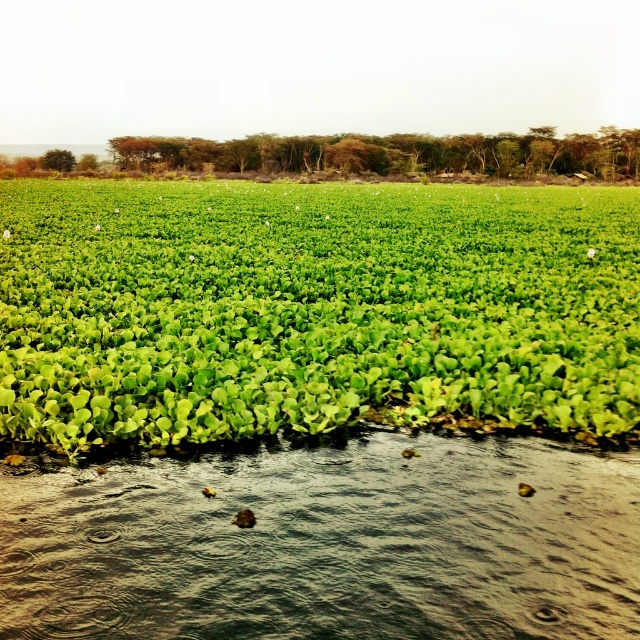
Question: Is green leafy plant at center bigger than green leafy water at lower center?

Choices:
 (A) no
 (B) yes

Answer: (B)

Question: Which point is farther to the camera?

Choices:
 (A) green leafy plant at center
 (B) green leafy water at lower center

Answer: (A)

Question: Is green leafy plant at center thinner than green leafy water at lower center?

Choices:
 (A) no
 (B) yes

Answer: (A)

Question: Can you confirm if green leafy plant at center is smaller than green leafy water at lower center?

Choices:
 (A) yes
 (B) no

Answer: (B)